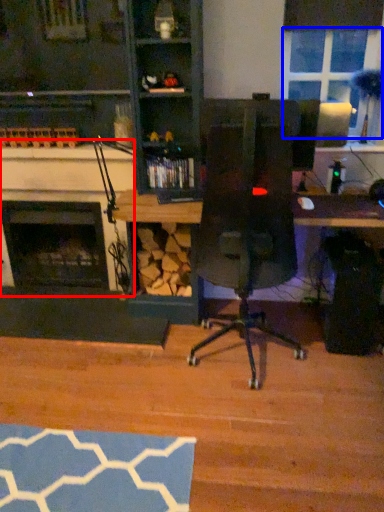
Question: Among these objects, which one is farthest to the camera, fireplace (highlighted by a red box) or window screen (highlighted by a blue box)?

Choices:
 (A) fireplace
 (B) window screen

Answer: (A)